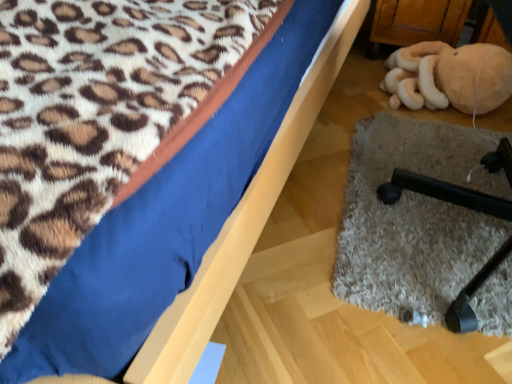
Question: From the image's perspective, is black rubber chair leg at lower right under blue fabric bed at upper left?

Choices:
 (A) no
 (B) yes

Answer: (B)

Question: Would you say black rubber chair leg at lower right is outside blue fabric bed at upper left?

Choices:
 (A) no
 (B) yes

Answer: (A)

Question: Is the depth of black rubber chair leg at lower right less than that of blue fabric bed at upper left?

Choices:
 (A) yes
 (B) no

Answer: (B)

Question: Is black rubber chair leg at lower right shorter than blue fabric bed at upper left?

Choices:
 (A) no
 (B) yes

Answer: (A)

Question: Does black rubber chair leg at lower right contain blue fabric bed at upper left?

Choices:
 (A) yes
 (B) no

Answer: (B)

Question: Is black rubber chair leg at lower right beside blue fabric bed at upper left?

Choices:
 (A) yes
 (B) no

Answer: (B)

Question: Can you confirm if blue fabric bed at upper left is thinner than beige plush toy at lower right?

Choices:
 (A) no
 (B) yes

Answer: (A)

Question: Is the position of blue fabric bed at upper left less distant than that of beige plush toy at lower right?

Choices:
 (A) yes
 (B) no

Answer: (A)

Question: Considering the relative sizes of blue fabric bed at upper left and beige plush toy at lower right in the image provided, is blue fabric bed at upper left shorter than beige plush toy at lower right?

Choices:
 (A) no
 (B) yes

Answer: (B)

Question: Does blue fabric bed at upper left have a smaller size compared to beige plush toy at lower right?

Choices:
 (A) yes
 (B) no

Answer: (B)

Question: Would you say blue fabric bed at upper left is a long distance from beige plush toy at lower right?

Choices:
 (A) yes
 (B) no

Answer: (B)

Question: Is blue fabric bed at upper left further to camera compared to beige plush toy at lower right?

Choices:
 (A) yes
 (B) no

Answer: (B)

Question: Considering the relative positions of beige plush toy at lower right and black rubber chair leg at lower right in the image provided, is beige plush toy at lower right behind black rubber chair leg at lower right?

Choices:
 (A) no
 (B) yes

Answer: (B)